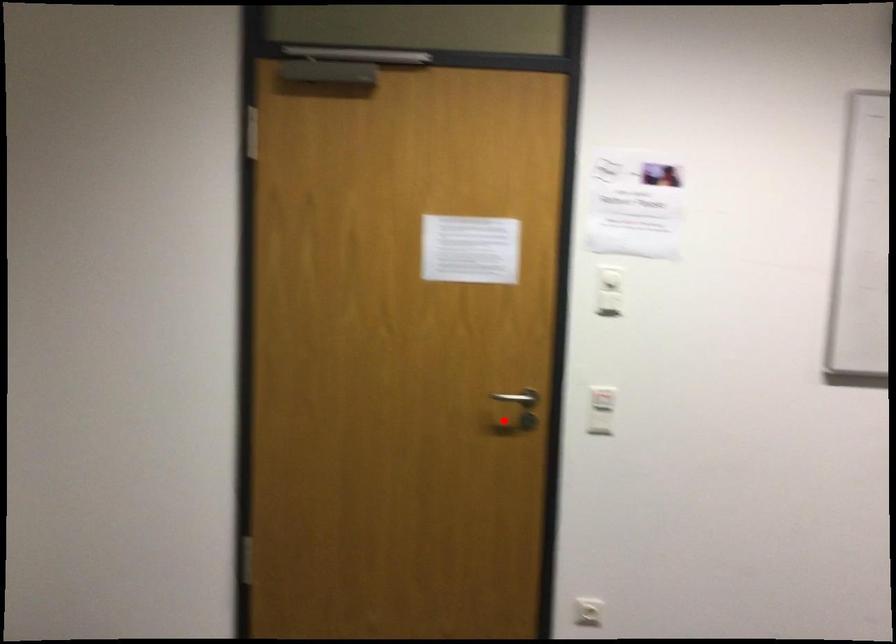
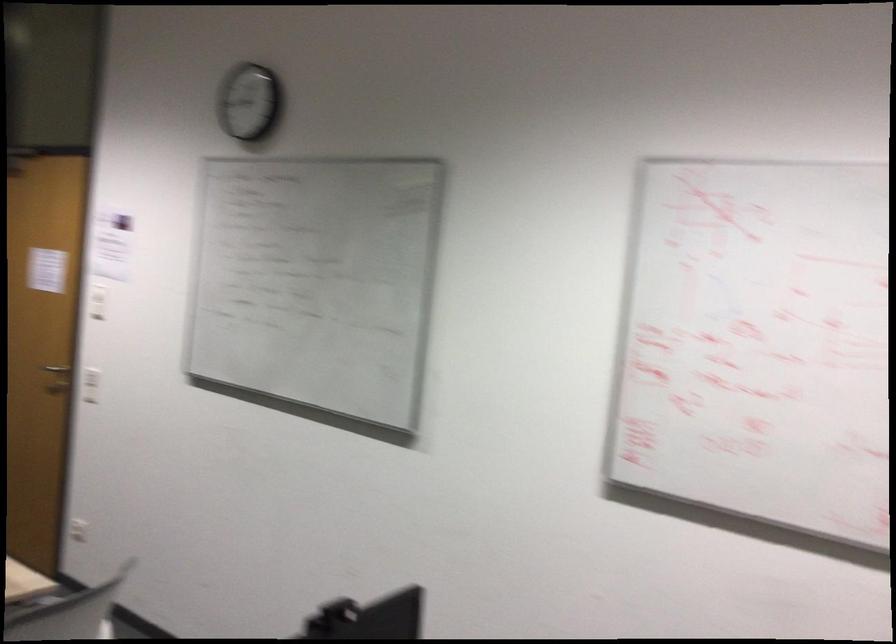
Find the pixel in the second image that matches the highlighted location in the first image.

(90, 384)